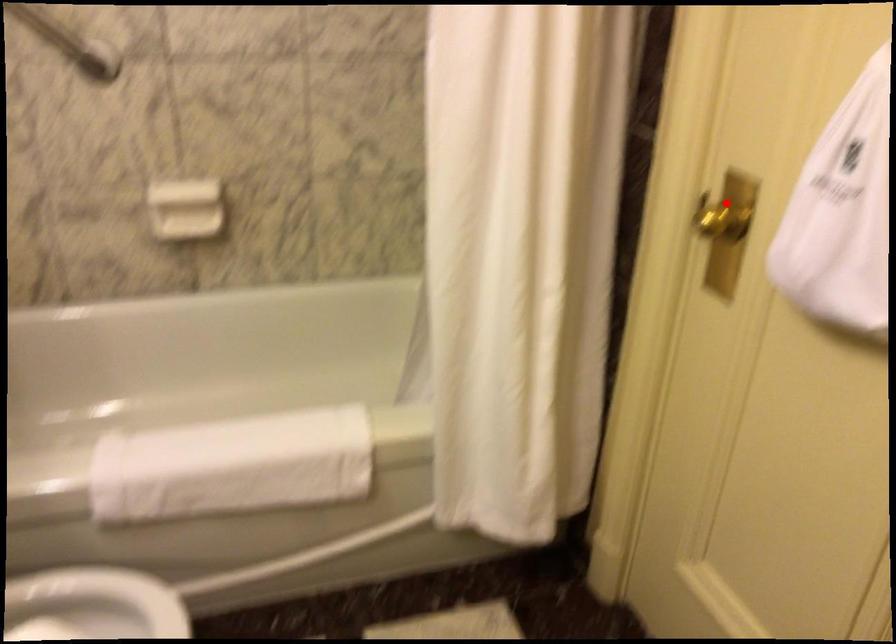
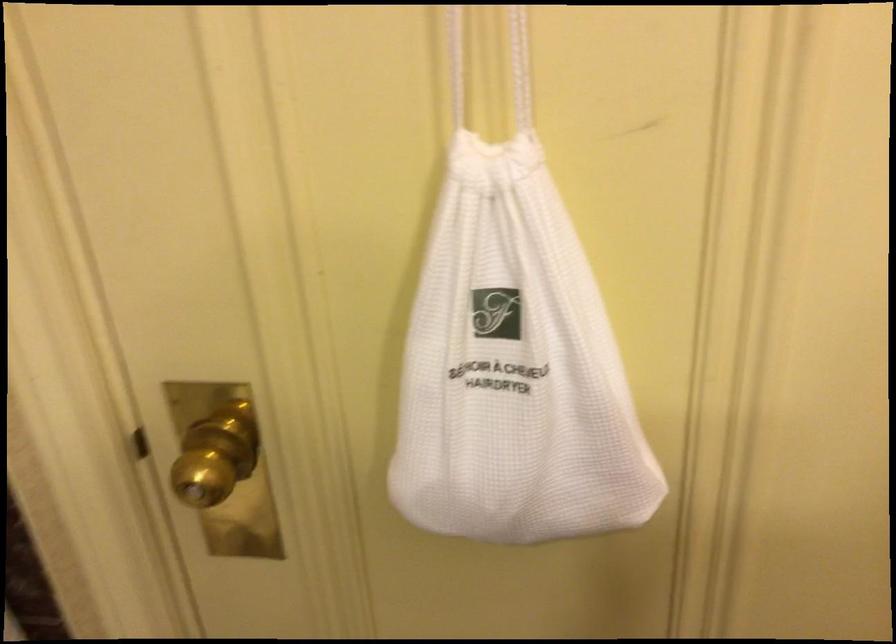
Question: A red point is marked in image1. In image2, is the corresponding 3D point closer to the camera or farther? Reply with the corresponding letter.

Choices:
 (A) The corresponding 3D point is closer.
 (B) The corresponding 3D point is farther.

Answer: (A)